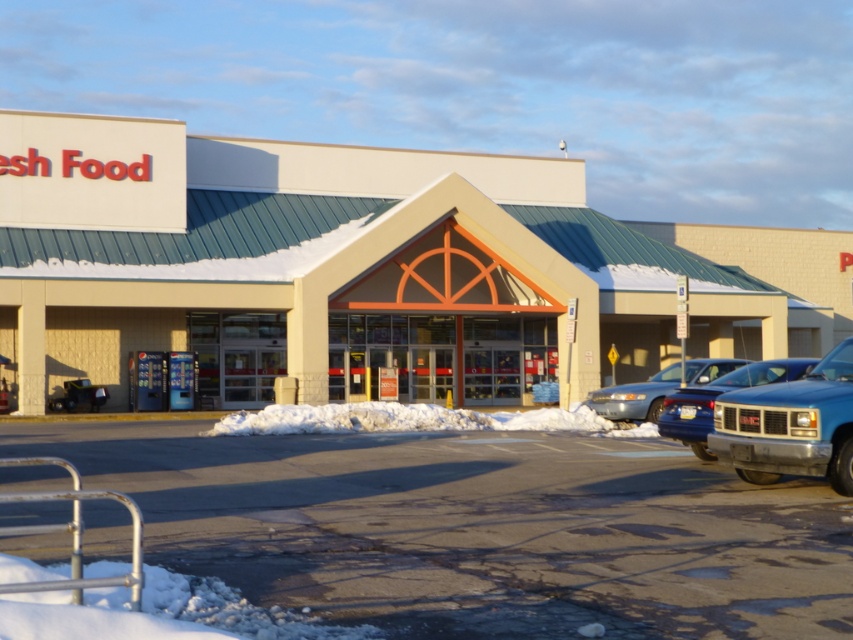
You are standing in front of the Fresh Food grocery store and want to walk to the entrance. There are two points marked on the ground in front of you. Which point, point (846,531) or point (387,419), is closer to you?

Point (846,531) is closer to the viewer than point (387,419).

You are a delivery driver who needs to park your blue metallic truck at right in the parking lot near the grocery store. However, there is a white fluffy snow at center blocking the parking spot. Can you drive around the snow pile without moving it?

The white fluffy snow at center is larger in size than the blue metallic truck at right, so it might block the path. You may need to clear the snow or choose another parking spot.